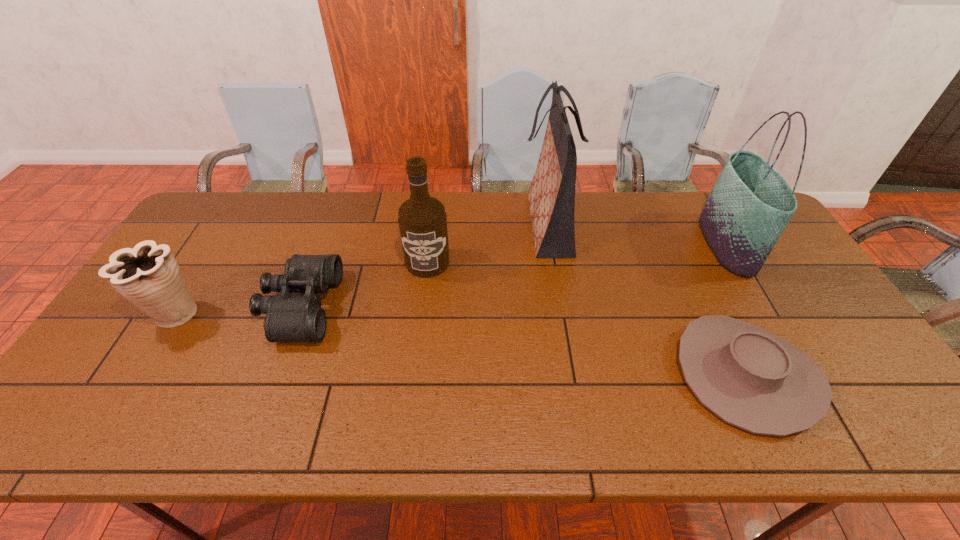
This screenshot has width=960, height=540. Find the location of `vacant point located between the third tallest object and the tote bag`. vacant point located between the third tallest object and the tote bag is located at coordinates (577, 253).

Where is `free spot between the fifth object from right to left and the urn`? free spot between the fifth object from right to left and the urn is located at coordinates (238, 310).

Where is `empty location between the cowboy hat and the tote bag`? This screenshot has height=540, width=960. empty location between the cowboy hat and the tote bag is located at coordinates (736, 309).

You are a GUI agent. You are given a task and a screenshot of the screen. Output one action in this format:
    pyautogui.click(x=<x>, y=<y>)
    Task: Click on the free spot between the third shortest object and the tote bag
    
    Given the screenshot: What is the action you would take?
    pyautogui.click(x=451, y=279)

Identify the location of vacant area between the shopping bag and the fourth tallest object. point(361,269).

You are a GUI agent. You are given a task and a screenshot of the screen. Output one action in this format:
    pyautogui.click(x=<x>, y=<y>)
    Task: Click on the vacant region between the shopping bag and the alcohol
    Image resolution: width=960 pixels, height=540 pixels.
    Given the screenshot: What is the action you would take?
    pyautogui.click(x=488, y=243)

The height and width of the screenshot is (540, 960). What are the coordinates of `free space between the urn and the tote bag` in the screenshot? It's located at (451, 279).

Where is `empty space between the tote bag and the second object from left to right`? The image size is (960, 540). empty space between the tote bag and the second object from left to right is located at coordinates (514, 275).

What are the coordinates of `vacant space in between the tote bag and the alcohol` in the screenshot? It's located at (577, 253).

Where is `object that stands as the fifth closest to the third object from right to left`? The image size is (960, 540). object that stands as the fifth closest to the third object from right to left is located at coordinates (148, 275).